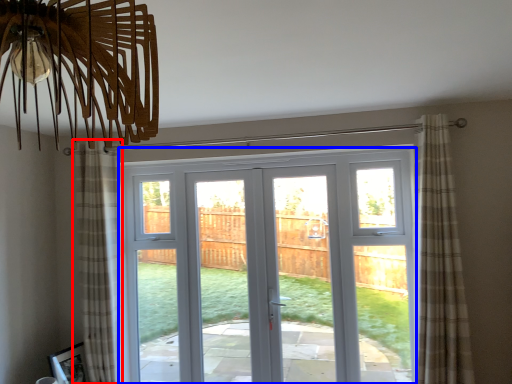
Question: Among these objects, which one is farthest to the camera, curtain (highlighted by a red box) or door (highlighted by a blue box)?

Choices:
 (A) curtain
 (B) door

Answer: (B)